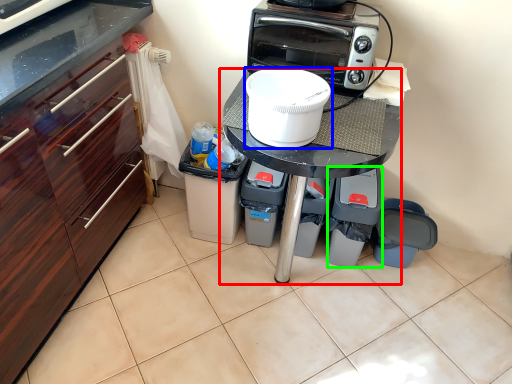
Question: Considering the real-world distances, which object is closest to table (highlighted by a red box)? home appliance (highlighted by a blue box) or appliance (highlighted by a green box).

Choices:
 (A) home appliance
 (B) appliance

Answer: (A)